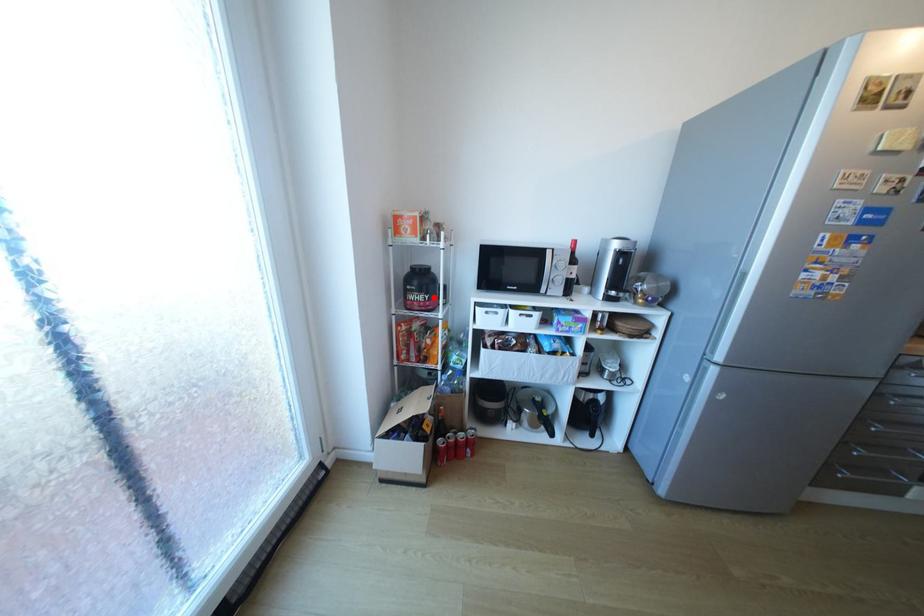
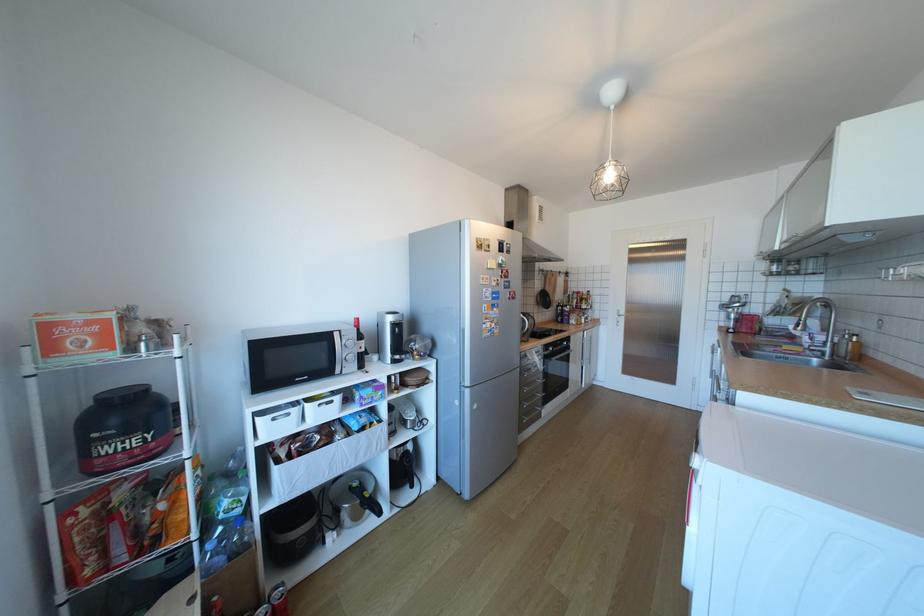
Where in the second image is the point corresponding to the highlighted location from the first image?

(152, 439)